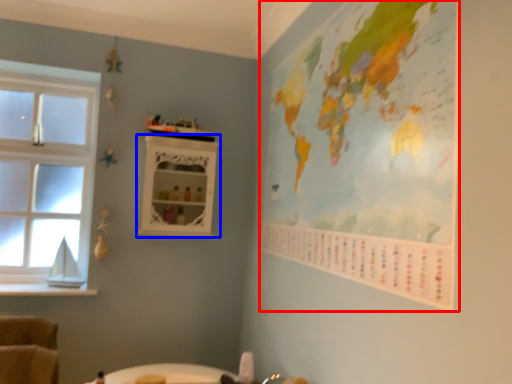
Question: Which of the following is the closest to the observer, map (highlighted by a red box) or shelf (highlighted by a blue box)?

Choices:
 (A) map
 (B) shelf

Answer: (A)